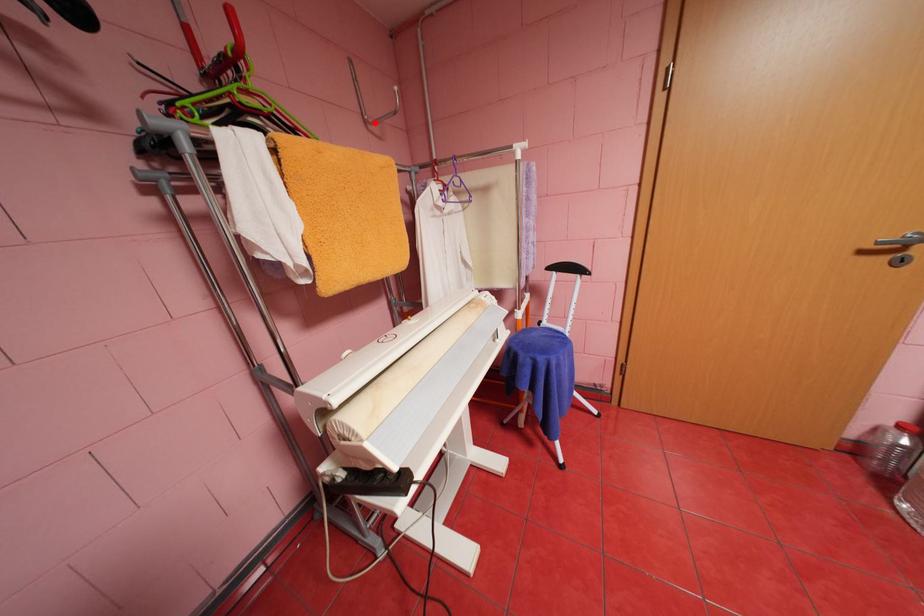
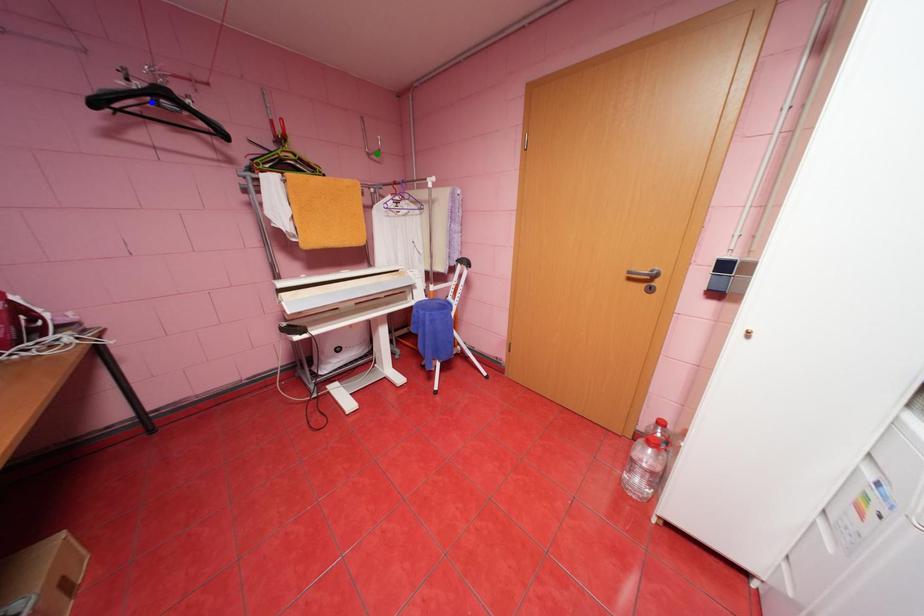
Question: I am providing you with two images of the same scene from different viewpoints. A red point is marked on the first image. You are given multiple points on the second image. Which point in image 2 represents the same 3d spot as the red point in image 1?

Choices:
 (A) yellow point
 (B) green point
 (C) blue point

Answer: (B)